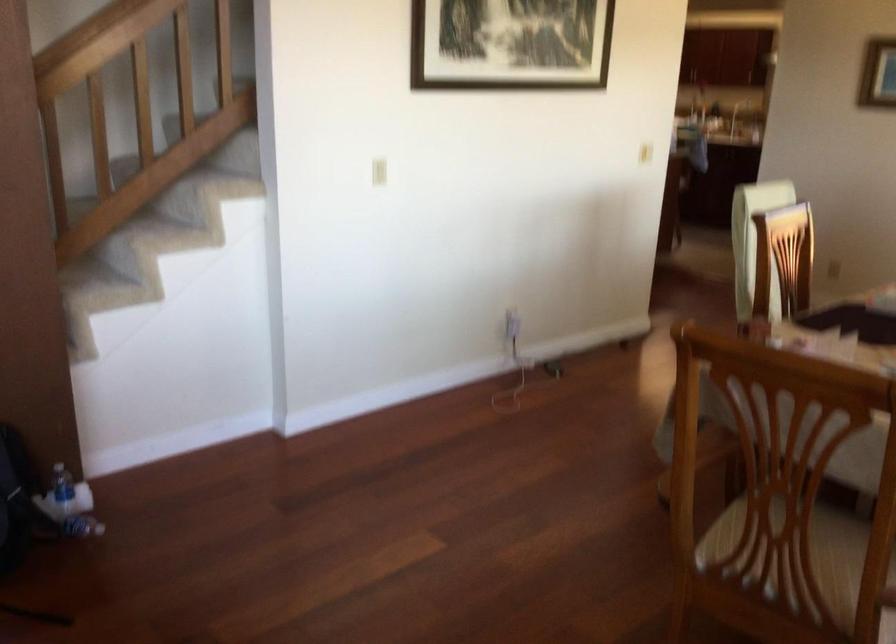
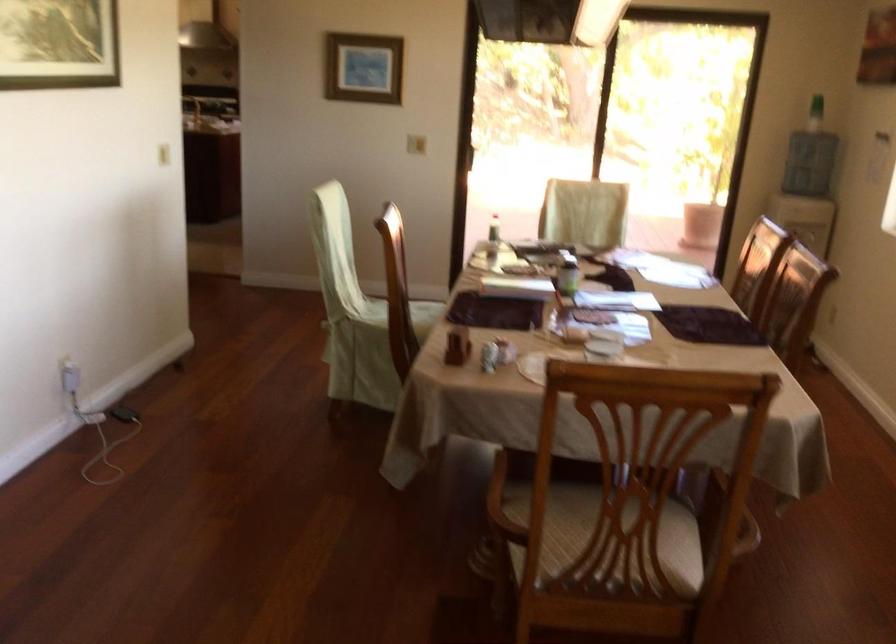
Find the pixel in the second image that matches [741,328] in the first image.

(458, 345)